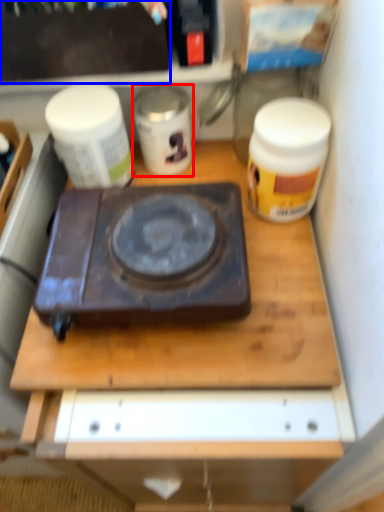
Question: Which point is closer to the camera, yoghurt (highlighted by a red box) or box (highlighted by a blue box)?

Choices:
 (A) yoghurt
 (B) box

Answer: (B)